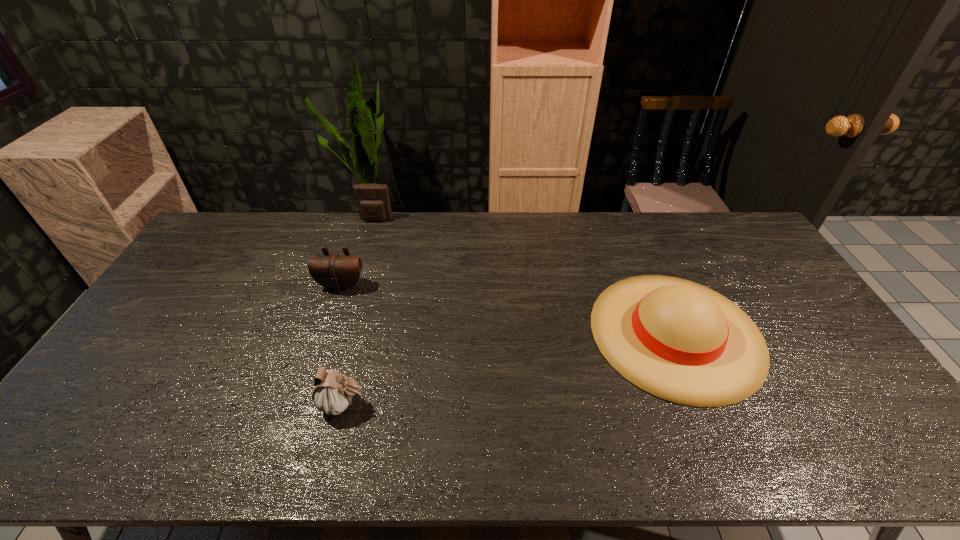
Identify the location of blank region between the nearest pouch and the sombrero. (510, 369).

This screenshot has height=540, width=960. Identify the location of empty space between the second farthest pouch and the farthest pouch. (358, 253).

Identify the location of vacant space in between the second nearest pouch and the nearest pouch. (342, 345).

Identify the location of free area in between the nearest pouch and the farthest object. Image resolution: width=960 pixels, height=540 pixels. tap(360, 312).

Locate an element on the screen. unoccupied position between the farthest pouch and the nearest pouch is located at coordinates (360, 312).

Locate an element on the screen. The width and height of the screenshot is (960, 540). vacant space that's between the rightmost object and the farthest pouch is located at coordinates (526, 276).

At what (x,y) coordinates should I click in order to perform the action: click on empty space between the sombrero and the nearest pouch. Please return your answer as a coordinate pair (x, y). The width and height of the screenshot is (960, 540). Looking at the image, I should click on (510, 369).

Choose which object is the nearest neighbor to the farthest object. Please provide its 2D coordinates. Your answer should be formatted as a tuple, i.e. [(x, y)], where the tuple contains the x and y coordinates of a point satisfying the conditions above.

[(336, 272)]

Identify the location of object that stands as the second closest to the farthest pouch. Image resolution: width=960 pixels, height=540 pixels. (333, 392).

In order to click on pouch that can be found as the closest to the nearest pouch in this screenshot , I will do `click(336, 272)`.